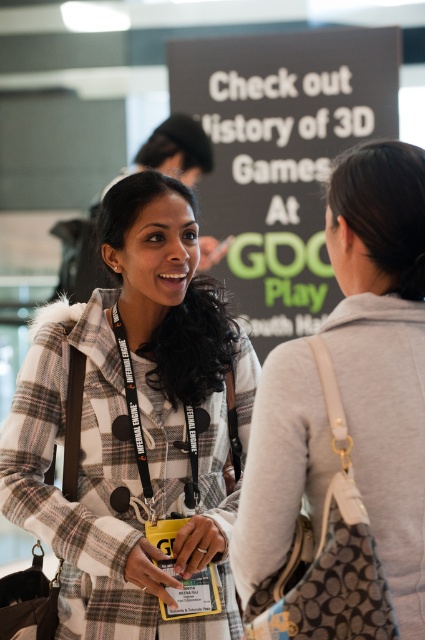
Who is positioned more to the left, plaid wool coat at center or black matte signboard at upper center?

plaid wool coat at center

Can you confirm if plaid wool coat at center is taller than black matte signboard at upper center?

In fact, plaid wool coat at center may be shorter than black matte signboard at upper center.

In order to click on plaid wool coat at center in this screenshot , I will do `click(136, 426)`.

Is gray fabric hoodie at upper right bigger than black matte signboard at upper center?

No.

Does gray fabric hoodie at upper right have a lesser height compared to black matte signboard at upper center?

Yes, gray fabric hoodie at upper right is shorter than black matte signboard at upper center.

Locate an element on the screen. This screenshot has height=640, width=425. gray fabric hoodie at upper right is located at coordinates (382, 349).

Does point (217, 561) lie behind point (379, 310)?

Yes.

Between plaid wool coat at center and gray fabric hoodie at upper right, which one has less height?

With less height is gray fabric hoodie at upper right.

Who is more distant from viewer, [68,605] or [368,422]?

The point [68,605] is behind.

Where is `plaid wool coat at center`? The image size is (425, 640). plaid wool coat at center is located at coordinates (136, 426).